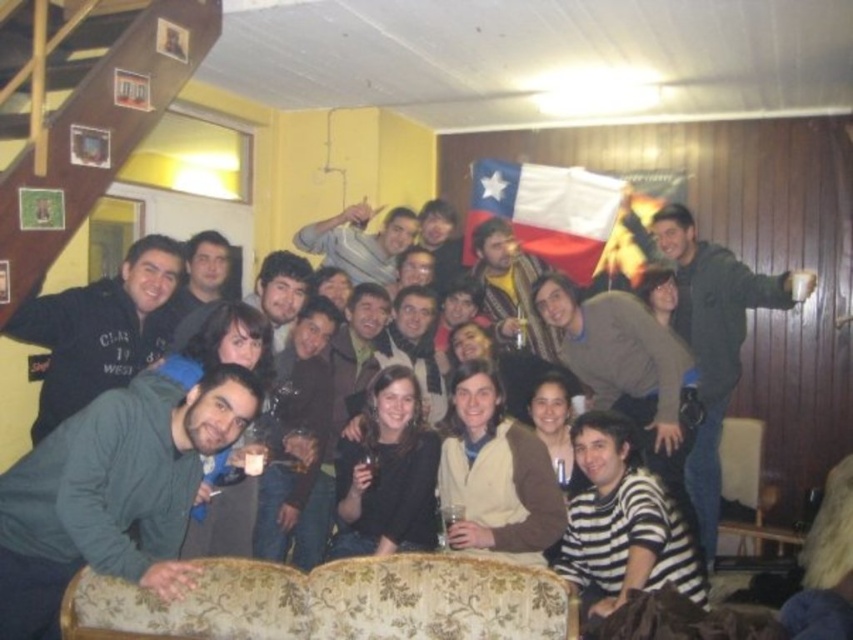
You are at a social gathering and see a Chilean flag on the wall. You want to point to the exact location of the point marked at coordinates (628,371). Where would that be in relation to the striped sweater at center?

The point marked at coordinates (628,371) is located on the striped sweater at center.

You are standing at the entrance of the room and want to greet the person wearing the dark gray hoodie at center. In which direction should you walk to reach them?

The dark gray hoodie at center is located at coordinates approximately 0.769 on the x axis and 0.134 on the y axis. Since you are at the entrance, you should walk towards the center of the room to reach them.

You are a guest at this event and want to take a photo of the Chilean flag in the background without any people blocking it. The dark gray hoodie at center is currently in your way. Where should you move to get a clear shot of the Chilean flag?

Move to the left side of the room away from the dark gray hoodie at center located at point (113, 492) to capture the Chilean flag without obstruction.